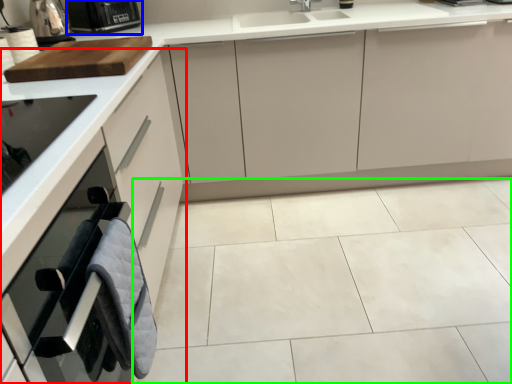
Question: Which is farther away from cabinetry (highlighted by a red box)? kitchen appliance (highlighted by a blue box) or ceramic tile (highlighted by a green box)?

Choices:
 (A) kitchen appliance
 (B) ceramic tile

Answer: (A)